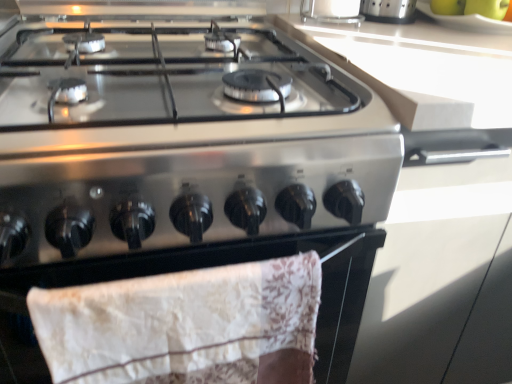
Question: Considering the relative sizes of green matte bananas at upper right, marked as the 2th fruit in a right-to-left arrangement, and clear glass container at upper center in the image provided, is green matte bananas at upper right, marked as the 2th fruit in a right-to-left arrangement, shorter than clear glass container at upper center?

Choices:
 (A) yes
 (B) no

Answer: (A)

Question: From the image's perspective, is green matte bananas at upper right, marked as the 1th fruit in a left-to-right arrangement, over clear glass container at upper center?

Choices:
 (A) yes
 (B) no

Answer: (B)

Question: Considering the relative sizes of green matte bananas at upper right, marked as the 2th fruit in a right-to-left arrangement, and clear glass container at upper center in the image provided, is green matte bananas at upper right, marked as the 2th fruit in a right-to-left arrangement, bigger than clear glass container at upper center?

Choices:
 (A) yes
 (B) no

Answer: (B)

Question: From a real-world perspective, is green matte bananas at upper right, marked as the 1th fruit in a left-to-right arrangement, under clear glass container at upper center?

Choices:
 (A) no
 (B) yes

Answer: (B)

Question: Is green matte bananas at upper right, marked as the 2th fruit in a right-to-left arrangement, beside clear glass container at upper center?

Choices:
 (A) no
 (B) yes

Answer: (A)

Question: Is green matte bananas at upper right, marked as the 1th fruit in a left-to-right arrangement, facing towards clear glass container at upper center?

Choices:
 (A) no
 (B) yes

Answer: (A)

Question: Is green matte apple at upper right, the second fruit when ordered from left to right, located outside green matte bananas at upper right, marked as the 1th fruit in a left-to-right arrangement?

Choices:
 (A) no
 (B) yes

Answer: (B)

Question: Does green matte apple at upper right, placed as the 1th fruit when sorted from right to left, have a lesser width compared to green matte bananas at upper right, marked as the 2th fruit in a right-to-left arrangement?

Choices:
 (A) no
 (B) yes

Answer: (A)

Question: Is green matte apple at upper right, placed as the 1th fruit when sorted from right to left, at the right side of green matte bananas at upper right, marked as the 1th fruit in a left-to-right arrangement?

Choices:
 (A) yes
 (B) no

Answer: (A)

Question: From the image's perspective, would you say green matte apple at upper right, placed as the 1th fruit when sorted from right to left, is shown under green matte bananas at upper right, marked as the 1th fruit in a left-to-right arrangement?

Choices:
 (A) no
 (B) yes

Answer: (B)

Question: Is green matte apple at upper right, the second fruit when ordered from left to right, wider than green matte bananas at upper right, marked as the 2th fruit in a right-to-left arrangement?

Choices:
 (A) yes
 (B) no

Answer: (A)

Question: From a real-world perspective, is green matte apple at upper right, placed as the 1th fruit when sorted from right to left, physically above green matte bananas at upper right, marked as the 1th fruit in a left-to-right arrangement?

Choices:
 (A) no
 (B) yes

Answer: (B)

Question: Is stainless steel gas stove at center surrounded by green matte bananas at upper right, marked as the 2th fruit in a right-to-left arrangement?

Choices:
 (A) no
 (B) yes

Answer: (A)